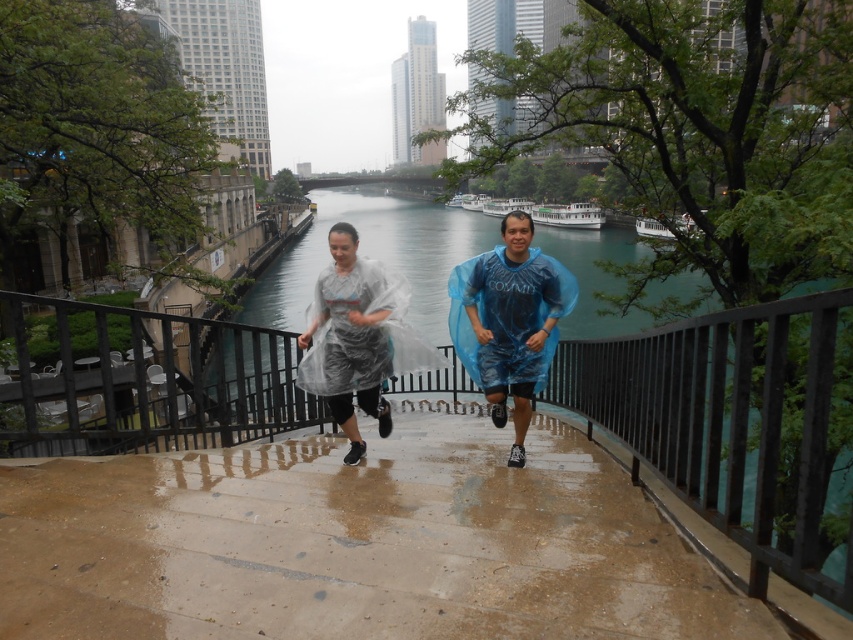
Is blue translucent poncho at center above transparent plastic poncho at center?

Incorrect, blue translucent poncho at center is not positioned above transparent plastic poncho at center.

Can you confirm if blue translucent poncho at center is positioned to the right of transparent plastic poncho at center?

Indeed, blue translucent poncho at center is positioned on the right side of transparent plastic poncho at center.

Describe the element at coordinates (514, 321) in the screenshot. I see `blue translucent poncho at center` at that location.

I want to click on blue translucent poncho at center, so click(514, 321).

Does brown concrete stairs at center appear on the left side of blue translucent poncho at center?

Indeed, brown concrete stairs at center is positioned on the left side of blue translucent poncho at center.

Measure the distance between brown concrete stairs at center and camera.

brown concrete stairs at center is 2.86 meters from camera.

Where is `brown concrete stairs at center`? brown concrete stairs at center is located at coordinates (354, 545).

Which of these two, brown concrete stairs at center or transparent plastic poncho at center, stands taller?

transparent plastic poncho at center is taller.

Locate an element on the screen. brown concrete stairs at center is located at coordinates pos(354,545).